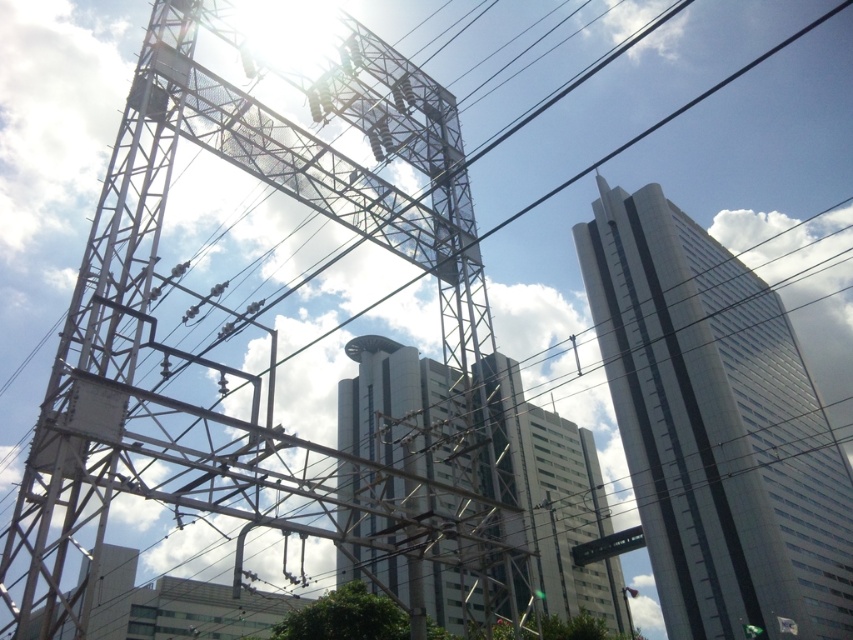
Can you confirm if metallic structure at left is thinner than silver metallic skyscraper at upper right?

Yes.

Does metallic structure at left have a smaller size compared to silver metallic skyscraper at upper right?

Indeed, metallic structure at left has a smaller size compared to silver metallic skyscraper at upper right.

Image resolution: width=853 pixels, height=640 pixels. Describe the element at coordinates (270, 342) in the screenshot. I see `metallic structure at left` at that location.

Identify the location of metallic structure at left. This screenshot has height=640, width=853. (270, 342).

Between silver metallic skyscraper at upper right and glassy white skyscraper at center, which one appears on the right side from the viewer's perspective?

silver metallic skyscraper at upper right is more to the right.

Who is positioned more to the left, silver metallic skyscraper at upper right or glassy white skyscraper at center?

Positioned to the left is glassy white skyscraper at center.

Does point (676, 388) come farther from viewer compared to point (479, 602)?

That is True.

You are a GUI agent. You are given a task and a screenshot of the screen. Output one action in this format:
    pyautogui.click(x=<x>, y=<y>)
    Task: Click on the silver metallic skyscraper at upper right
    The image size is (853, 640).
    Given the screenshot: What is the action you would take?
    pyautogui.click(x=717, y=428)

In the scene shown: Does metallic structure at left have a lesser width compared to glassy white skyscraper at center?

Yes.

Who is positioned more to the left, metallic structure at left or glassy white skyscraper at center?

From the viewer's perspective, metallic structure at left appears more on the left side.

Where is `metallic structure at left`? Image resolution: width=853 pixels, height=640 pixels. metallic structure at left is located at coordinates [x=270, y=342].